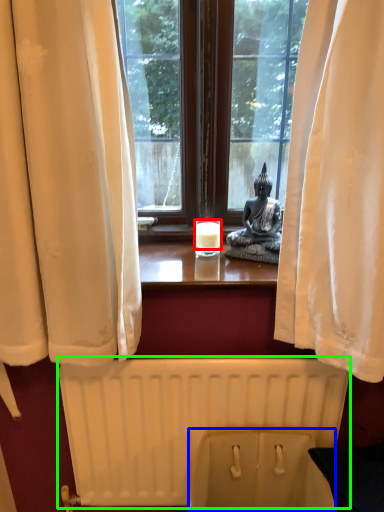
Question: Which object is the closest to the candle (highlighted by a red box)? Choose among these: toilet bowl (highlighted by a blue box) or radiator (highlighted by a green box).

Choices:
 (A) toilet bowl
 (B) radiator

Answer: (B)